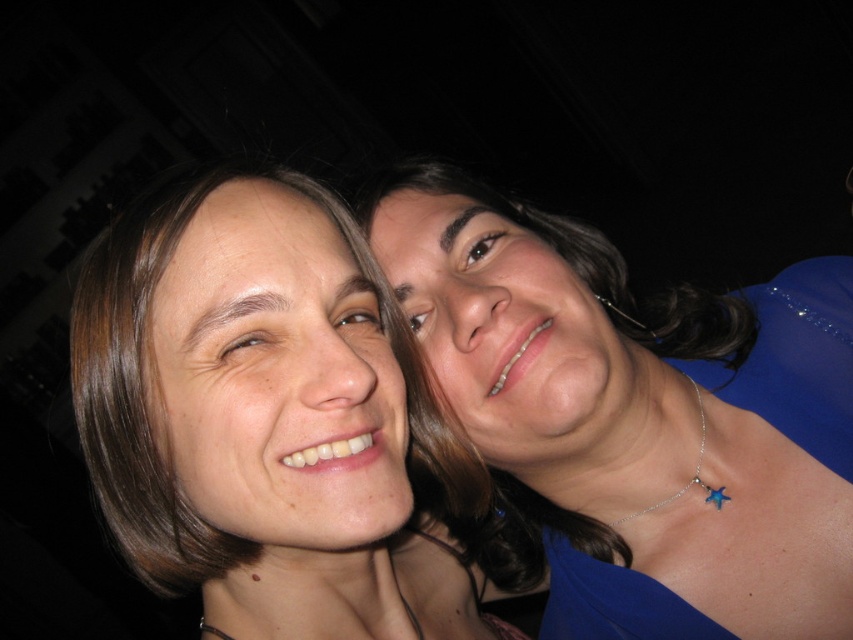
Question: Can you confirm if blue satin dress at right is positioned above smooth skin face at center?

Choices:
 (A) no
 (B) yes

Answer: (B)

Question: Does blue satin dress at right have a smaller size compared to smooth skin face at center?

Choices:
 (A) no
 (B) yes

Answer: (A)

Question: Which of the following is the closest to the observer?

Choices:
 (A) (90, 301)
 (B) (596, 323)

Answer: (A)

Question: Considering the relative positions of blue satin dress at right and smooth skin face at center in the image provided, where is blue satin dress at right located with respect to smooth skin face at center?

Choices:
 (A) above
 (B) below

Answer: (A)

Question: Among these points, which one is nearest to the camera?

Choices:
 (A) (334, 588)
 (B) (807, 596)

Answer: (A)

Question: Which object appears farthest from the camera in this image?

Choices:
 (A) smooth skin face at center
 (B) blue satin dress at right

Answer: (B)